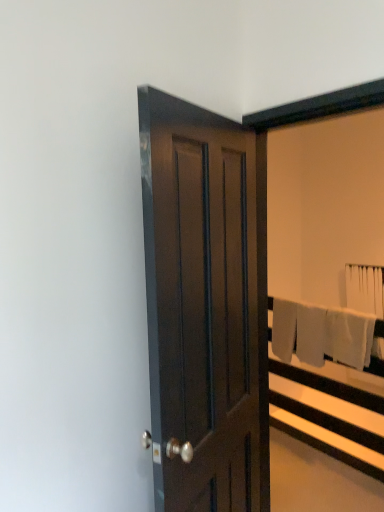
At what (x,y) coordinates should I click in order to perform the action: click on free spot below white cotton bath towel at right, the first bath towel when ordered from front to back (from a real-world perspective). Please return your answer as a coordinate pair (x, y). This screenshot has height=512, width=384. Looking at the image, I should click on (323, 456).